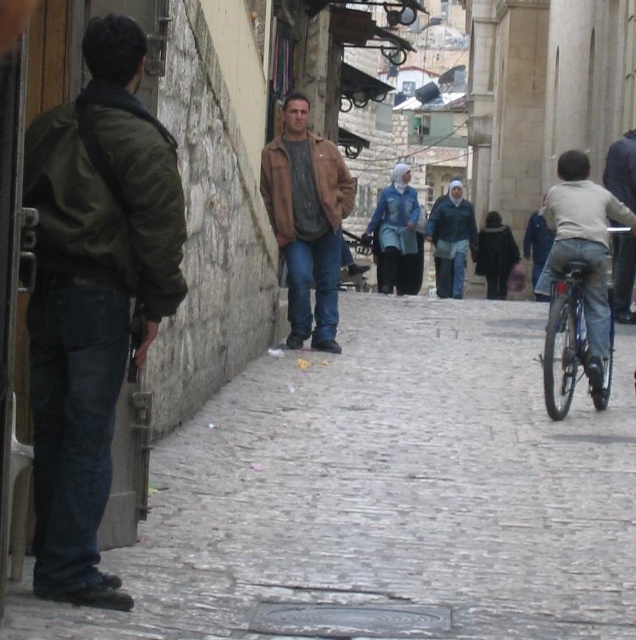
Question: Is dark blue jeans at center smaller than light brown leather jacket at center?

Choices:
 (A) no
 (B) yes

Answer: (A)

Question: Which point appears closest to the camera in this image?

Choices:
 (A) [x=404, y=243]
 (B) [x=616, y=320]
 (C) [x=326, y=337]
 (D) [x=569, y=243]

Answer: (D)

Question: Based on their relative distances, which object is nearer to the blue fabric headscarf at center?

Choices:
 (A) light beige jersey at right
 (B) brown leather jacket at center

Answer: (A)

Question: Is brown leather jacket at center to the left of light brown leather jacket at center from the viewer's perspective?

Choices:
 (A) no
 (B) yes

Answer: (B)

Question: Is cobblestone pavement at lower left below blue fabric headscarf at center?

Choices:
 (A) no
 (B) yes

Answer: (B)

Question: Considering the real-world distances, which object is farthest from the cobblestone pavement at lower left?

Choices:
 (A) green matte jacket at left
 (B) blue fabric headscarf at center

Answer: (B)